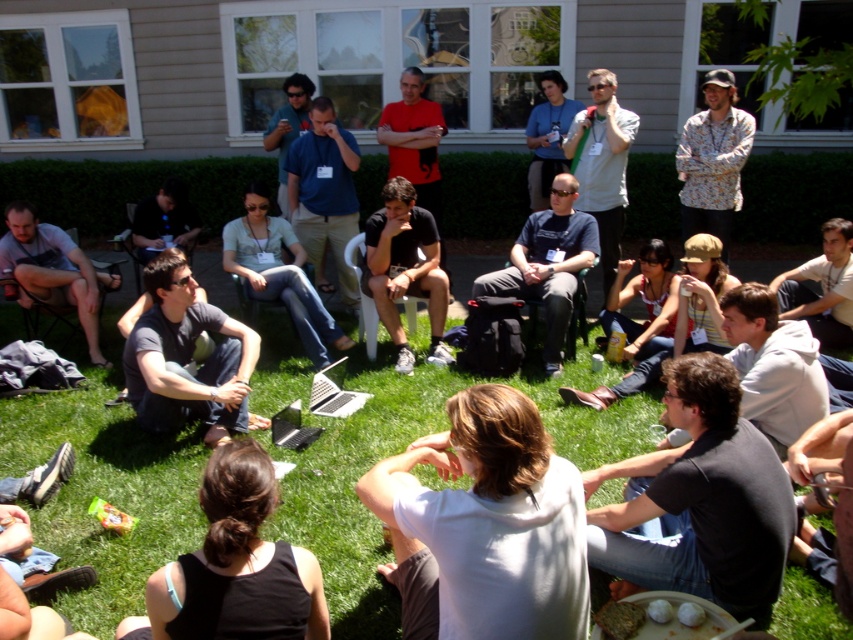
Question: Observing the image, what is the correct spatial positioning of matte gray shirt at center in reference to matte gray shirt at lower left?

Choices:
 (A) below
 (B) above

Answer: (A)

Question: Is black matte shirt at lower right bigger than floral shirt at upper right?

Choices:
 (A) yes
 (B) no

Answer: (B)

Question: Which of the following is the farthest from the observer?

Choices:
 (A) matte gray shirt at center
 (B) matte gray shirt at lower left

Answer: (B)

Question: Considering the real-world distances, which object is closest to the black matte shirt at center?

Choices:
 (A) floral shirt at upper right
 (B) light gray shirt at upper center
 (C) blue shirt at center
 (D) white shirt at center

Answer: (C)

Question: Is dark blue t-shirt at center smaller than matte blue shirt at upper center?

Choices:
 (A) no
 (B) yes

Answer: (A)

Question: Which object is closer to the camera taking this photo?

Choices:
 (A) matte gray shirt at lower left
 (B) green grass at lower center
 (C) white shirt at center

Answer: (B)